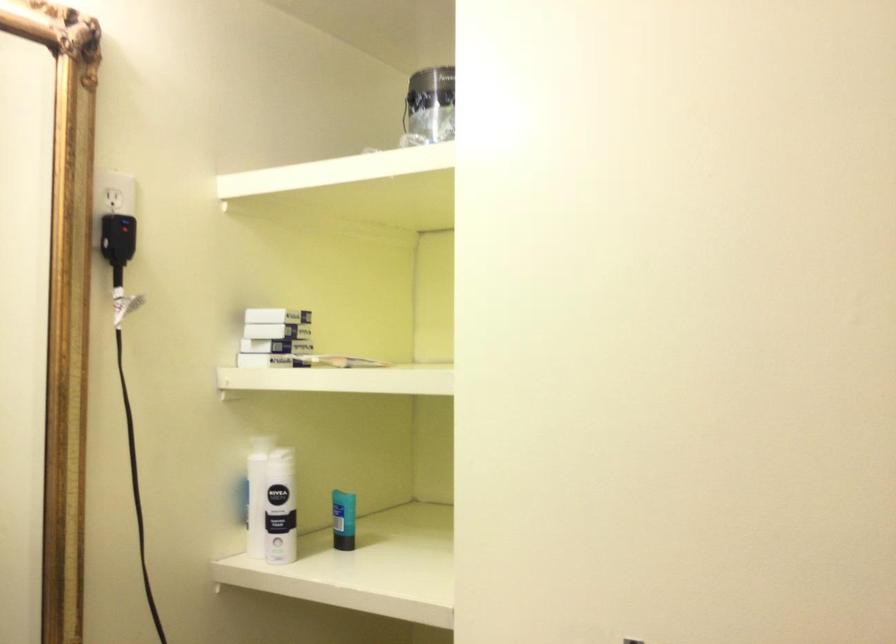
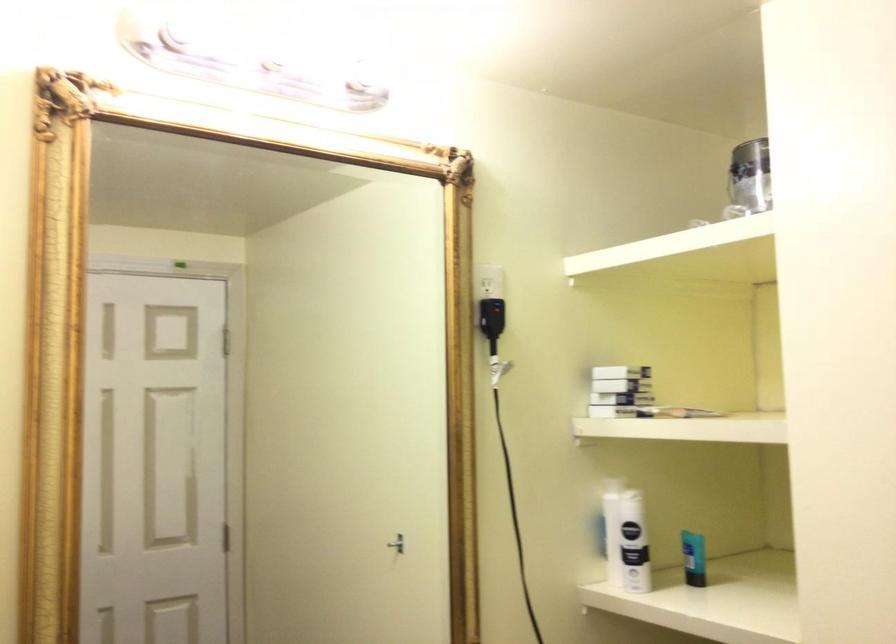
Where in the second image is the point corresponding to (415,108) from the first image?

(750, 178)